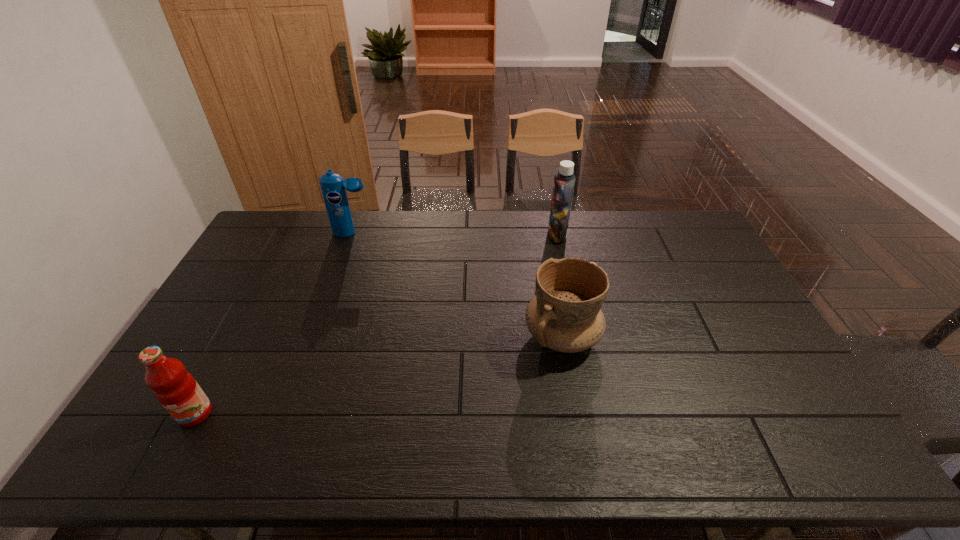
Locate an element on the screen. the right shampoo is located at coordinates (563, 188).

Identify the location of the second object from left to right. (333, 187).

You are a GUI agent. You are given a task and a screenshot of the screen. Output one action in this format:
    pyautogui.click(x=<x>, y=<y>)
    Task: Click on the leftmost object
    The image size is (960, 540).
    Given the screenshot: What is the action you would take?
    pyautogui.click(x=176, y=389)

This screenshot has height=540, width=960. Find the location of `the nearest object`. the nearest object is located at coordinates (176, 389).

Where is `the second nearest object`? the second nearest object is located at coordinates (565, 315).

Identify the location of free point located on the front label of the right shampoo. This screenshot has height=540, width=960. (454, 235).

I want to click on vacant area situated 0.400m on the front label of the right shampoo, so click(442, 235).

At what (x,y) coordinates should I click in order to perform the action: click on vacant space located 0.360m on the front label of the right shampoo. Please return your answer as a coordinate pair (x, y). The width and height of the screenshot is (960, 540). Looking at the image, I should click on (452, 235).

Find the location of a particular element. The image size is (960, 540). vacant space located 0.120m on the back of the left shampoo is located at coordinates (361, 211).

You are a GUI agent. You are given a task and a screenshot of the screen. Output one action in this format:
    pyautogui.click(x=<x>, y=<y>)
    Task: Click on the free space located on the front label of the leftmost object
    Image resolution: width=960 pixels, height=540 pixels.
    Given the screenshot: What is the action you would take?
    (x=175, y=452)